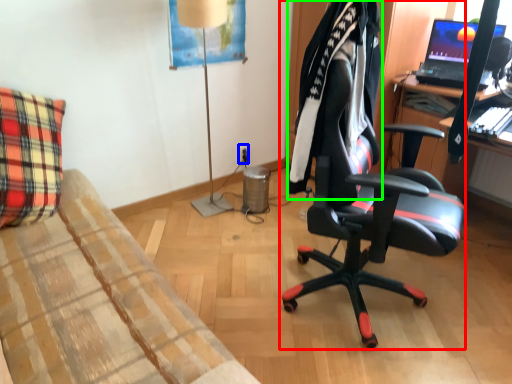
Question: Which is farther away from chair (highlighted by a red box)? power outlet (highlighted by a blue box) or clothing (highlighted by a green box)?

Choices:
 (A) power outlet
 (B) clothing

Answer: (A)